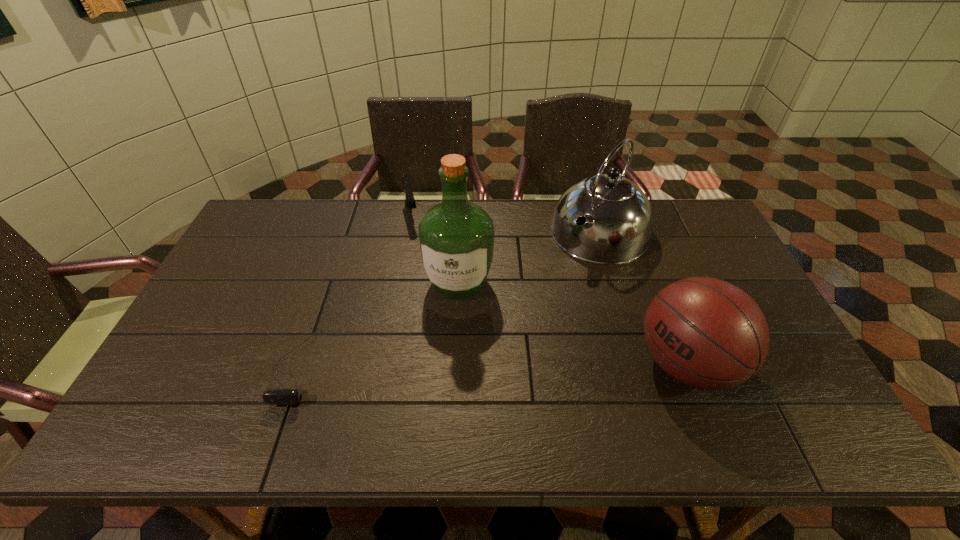
Image resolution: width=960 pixels, height=540 pixels. What are the coordinates of `webcam that is at the near edge` in the screenshot? It's located at (281, 396).

Image resolution: width=960 pixels, height=540 pixels. I want to click on basketball located at the near edge, so click(x=706, y=333).

The height and width of the screenshot is (540, 960). Identify the location of object at the right edge. (706, 333).

Locate an element on the screen. The width and height of the screenshot is (960, 540). object that is at the near right corner is located at coordinates (706, 333).

Where is `free space at the far edge of the desktop`? Image resolution: width=960 pixels, height=540 pixels. free space at the far edge of the desktop is located at coordinates (361, 223).

Find the location of `free space at the left edge`. free space at the left edge is located at coordinates (184, 332).

I want to click on free region at the right edge, so click(x=724, y=261).

In the image, there is a desktop. Identify the location of vacant area at the far left corner. (275, 234).

Identify the location of free space at the near left corner. (149, 390).

Identify the location of free location at the far right corner. The height and width of the screenshot is (540, 960). click(x=654, y=205).